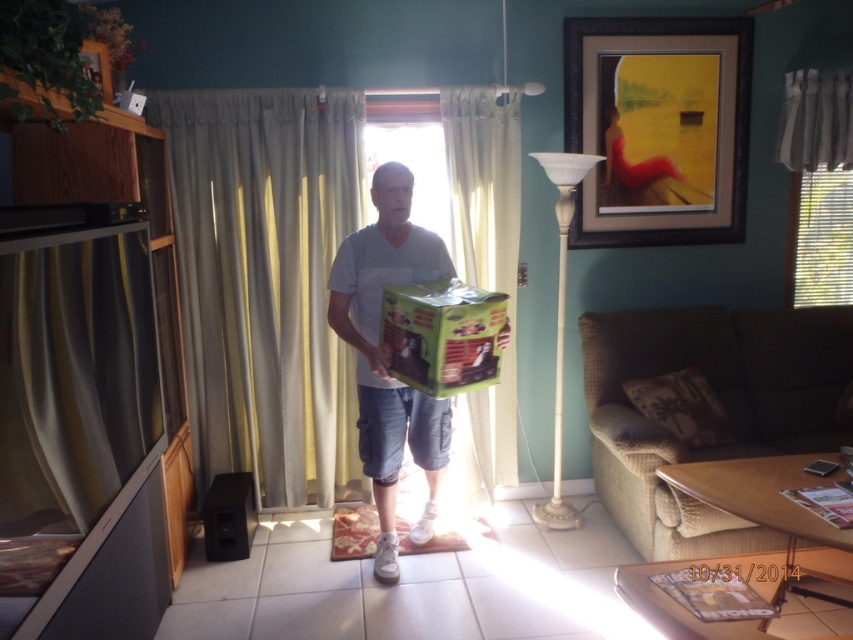
Question: Considering the relative positions of wooden framed artwork at upper right and white sheer curtain at center in the image provided, where is wooden framed artwork at upper right located with respect to white sheer curtain at center?

Choices:
 (A) left
 (B) right

Answer: (B)

Question: Which object is closer to the camera taking this photo?

Choices:
 (A) matte green cardboard box at center
 (B) white sheer curtain at center
 (C) green matte cardboard box at lower left
 (D) green fabric curtain at center

Answer: (A)

Question: Which point appears farthest from the camera in this image?

Choices:
 (A) [216, 477]
 (B) [564, 104]
 (C) [442, 397]

Answer: (B)

Question: Where is silky yellow curtain at left located in relation to green matte cardboard box at lower left in the image?

Choices:
 (A) below
 (B) above

Answer: (B)

Question: Does white sheer curtain at center appear on the left side of green matte cardboard box at lower left?

Choices:
 (A) no
 (B) yes

Answer: (A)

Question: Which object is farther from the camera taking this photo?

Choices:
 (A) green matte box at center
 (B) green matte cardboard box at lower left
 (C) wooden framed artwork at upper right

Answer: (C)